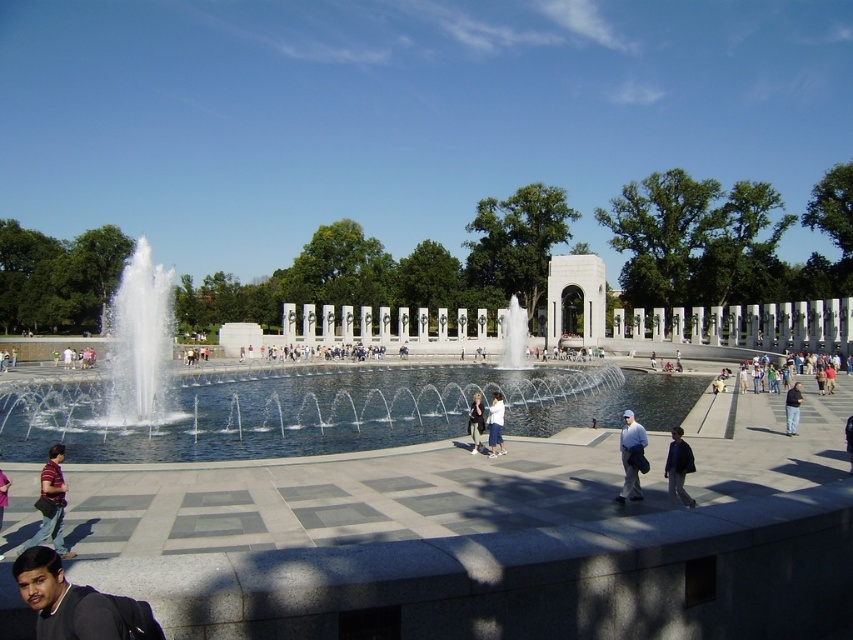
Find the location of `light blue denim jacket at center`. light blue denim jacket at center is located at coordinates (630, 456).

Does light blue denim jacket at center appear over matte purple shirt at lower left?

Correct, light blue denim jacket at center is located above matte purple shirt at lower left.

Is point (631, 448) positioned before point (1, 552)?

No, (631, 448) is further to viewer.

Identify the location of light blue denim jacket at center. (630, 456).

Who is higher up, dark gray sweater at lower left or light blue denim jacket at center?

Positioned higher is light blue denim jacket at center.

Is dark gray sweater at lower left further to camera compared to light blue denim jacket at center?

No, dark gray sweater at lower left is closer to the viewer.

Does point (157, 628) come in front of point (631, 486)?

Yes, point (157, 628) is closer to viewer.

The image size is (853, 640). Find the location of `dark gray sweater at lower left`. dark gray sweater at lower left is located at coordinates (77, 604).

Who is taller, dark gray sweater at lower left or dark blue jacket at center?

Standing taller between the two is dark blue jacket at center.

Is point (10, 570) farther from camera compared to point (670, 461)?

That is False.

Locate an element on the screen. The height and width of the screenshot is (640, 853). dark gray sweater at lower left is located at coordinates (77, 604).